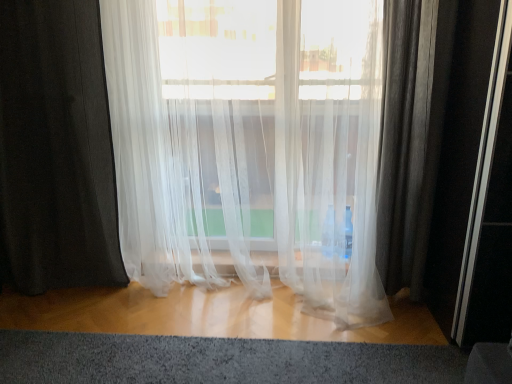
Question: From a real-world perspective, does black sheer curtain at left, the second curtain when ordered from right to left, stand above translucent white curtain at center, the 1th curtain when ordered from right to left?

Choices:
 (A) yes
 (B) no

Answer: (A)

Question: Considering the relative sizes of black sheer curtain at left, the second curtain when ordered from right to left, and translucent white curtain at center, the 1th curtain when ordered from right to left, in the image provided, is black sheer curtain at left, the second curtain when ordered from right to left, taller than translucent white curtain at center, the 1th curtain when ordered from right to left,?

Choices:
 (A) yes
 (B) no

Answer: (A)

Question: Considering the relative sizes of black sheer curtain at left, the second curtain when ordered from right to left, and translucent white curtain at center, the 1th curtain when ordered from right to left, in the image provided, is black sheer curtain at left, the second curtain when ordered from right to left, smaller than translucent white curtain at center, the 1th curtain when ordered from right to left,?

Choices:
 (A) yes
 (B) no

Answer: (A)

Question: From the image's perspective, is black sheer curtain at left, the 1th curtain viewed from the left, located above translucent white curtain at center, which is the 2th curtain from left to right?

Choices:
 (A) no
 (B) yes

Answer: (B)

Question: Considering the relative positions of black sheer curtain at left, the 1th curtain viewed from the left, and translucent white curtain at center, the 1th curtain when ordered from right to left, in the image provided, is black sheer curtain at left, the 1th curtain viewed from the left, to the right of translucent white curtain at center, the 1th curtain when ordered from right to left, from the viewer's perspective?

Choices:
 (A) yes
 (B) no

Answer: (B)

Question: Can you confirm if black sheer curtain at left, the 1th curtain viewed from the left, is bigger than translucent white curtain at center, which is the 2th curtain from left to right?

Choices:
 (A) no
 (B) yes

Answer: (A)

Question: Considering the relative sizes of textured gray carpet at lower center and black sheer curtain at left, the second curtain when ordered from right to left, in the image provided, is textured gray carpet at lower center smaller than black sheer curtain at left, the second curtain when ordered from right to left,?

Choices:
 (A) yes
 (B) no

Answer: (A)

Question: From the image's perspective, would you say textured gray carpet at lower center is shown under black sheer curtain at left, the second curtain when ordered from right to left?

Choices:
 (A) no
 (B) yes

Answer: (B)

Question: Is textured gray carpet at lower center wider than black sheer curtain at left, the second curtain when ordered from right to left?

Choices:
 (A) yes
 (B) no

Answer: (A)

Question: Would you say textured gray carpet at lower center is a long distance from black sheer curtain at left, the second curtain when ordered from right to left?

Choices:
 (A) no
 (B) yes

Answer: (A)

Question: From a real-world perspective, is textured gray carpet at lower center below black sheer curtain at left, the second curtain when ordered from right to left?

Choices:
 (A) yes
 (B) no

Answer: (A)

Question: Is textured gray carpet at lower center taller than black sheer curtain at left, the 1th curtain viewed from the left?

Choices:
 (A) yes
 (B) no

Answer: (B)

Question: Is black sheer curtain at left, the second curtain when ordered from right to left, surrounding textured gray carpet at lower center?

Choices:
 (A) yes
 (B) no

Answer: (B)